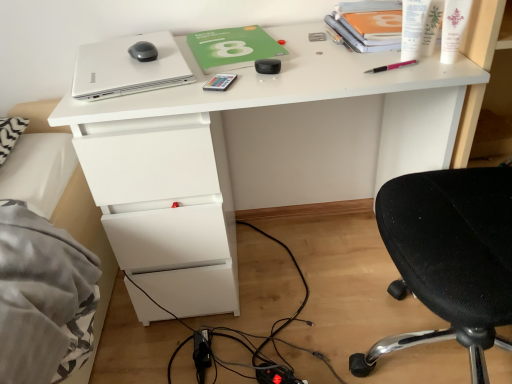
Locate an element on the screen. Image resolution: width=512 pixels, height=384 pixels. free space in front of pink plastic pen at upper right, placed as the 3th stationery when sorted from right to left is located at coordinates (401, 78).